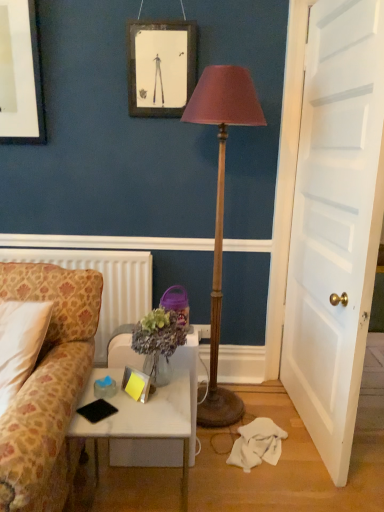
Question: Is patterned fabric couch at left far away from white textured radiator at left?

Choices:
 (A) yes
 (B) no

Answer: (B)

Question: Is patterned fabric couch at left turned away from white textured radiator at left?

Choices:
 (A) no
 (B) yes

Answer: (B)

Question: From the image's perspective, would you say patterned fabric couch at left is shown under white textured radiator at left?

Choices:
 (A) yes
 (B) no

Answer: (A)

Question: Is patterned fabric couch at left positioned in front of white textured radiator at left?

Choices:
 (A) no
 (B) yes

Answer: (B)

Question: Would you say patterned fabric couch at left contains white textured radiator at left?

Choices:
 (A) yes
 (B) no

Answer: (B)

Question: From a real-world perspective, is patterned fabric couch at left below white textured radiator at left?

Choices:
 (A) no
 (B) yes

Answer: (A)

Question: Considering the relative sizes of wooden floor lamp at center and white marble desk at lower left in the image provided, is wooden floor lamp at center taller than white marble desk at lower left?

Choices:
 (A) no
 (B) yes

Answer: (B)

Question: Is wooden floor lamp at center to the left of white marble desk at lower left from the viewer's perspective?

Choices:
 (A) yes
 (B) no

Answer: (B)

Question: Does wooden floor lamp at center lie in front of white marble desk at lower left?

Choices:
 (A) no
 (B) yes

Answer: (A)

Question: Does wooden floor lamp at center lie behind white marble desk at lower left?

Choices:
 (A) no
 (B) yes

Answer: (B)

Question: Is white marble desk at lower left inside wooden floor lamp at center?

Choices:
 (A) yes
 (B) no

Answer: (B)

Question: Is wooden floor lamp at center at the right side of white marble desk at lower left?

Choices:
 (A) no
 (B) yes

Answer: (B)

Question: Is white textured radiator at left wider than white wooden door at right?

Choices:
 (A) no
 (B) yes

Answer: (A)